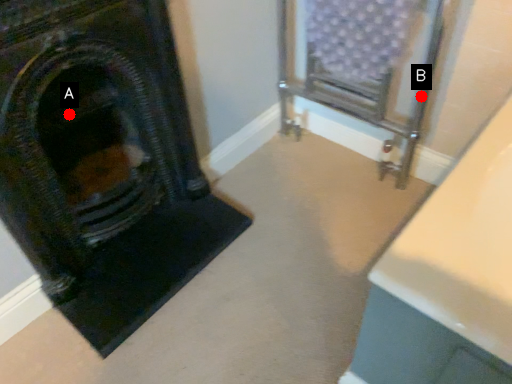
Question: Two points are circled on the image, labeled by A and B beside each circle. Which point is further to the camera?

Choices:
 (A) A is further
 (B) B is further

Answer: (B)